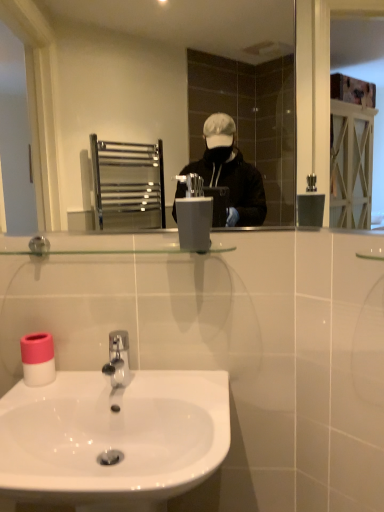
Question: Is white matte toilet paper at lower left bigger than satin grey plastic at center?

Choices:
 (A) yes
 (B) no

Answer: (B)

Question: Is satin grey plastic at center located within white matte toilet paper at lower left?

Choices:
 (A) yes
 (B) no

Answer: (B)

Question: Can you see white matte toilet paper at lower left touching satin grey plastic at center?

Choices:
 (A) no
 (B) yes

Answer: (A)

Question: From the image's perspective, is white matte toilet paper at lower left above satin grey plastic at center?

Choices:
 (A) yes
 (B) no

Answer: (B)

Question: Are white matte toilet paper at lower left and satin grey plastic at center located far from each other?

Choices:
 (A) yes
 (B) no

Answer: (B)

Question: In the image, is white glossy sink at lower center on the left side or the right side of satin grey plastic at center?

Choices:
 (A) right
 (B) left

Answer: (B)

Question: Is white glossy sink at lower center in front of or behind satin grey plastic at center in the image?

Choices:
 (A) front
 (B) behind

Answer: (A)

Question: From the image's perspective, is white glossy sink at lower center positioned above or below satin grey plastic at center?

Choices:
 (A) above
 (B) below

Answer: (B)

Question: Considering the positions of white glossy sink at lower center and satin grey plastic at center in the image, is white glossy sink at lower center taller or shorter than satin grey plastic at center?

Choices:
 (A) short
 (B) tall

Answer: (B)

Question: Considering the positions of satin grey plastic at center and white glossy sink at lower center in the image, is satin grey plastic at center taller or shorter than white glossy sink at lower center?

Choices:
 (A) tall
 (B) short

Answer: (B)

Question: Considering the relative positions of satin grey plastic at center and white glossy sink at lower center in the image provided, is satin grey plastic at center to the left or to the right of white glossy sink at lower center?

Choices:
 (A) left
 (B) right

Answer: (B)

Question: Is satin grey plastic at center wider or thinner than white glossy sink at lower center?

Choices:
 (A) thin
 (B) wide

Answer: (A)

Question: Would you say satin grey plastic at center is inside or outside white glossy sink at lower center?

Choices:
 (A) outside
 (B) inside

Answer: (A)

Question: In terms of height, does metallic silver mirror at upper center look taller or shorter compared to white matte toilet paper at lower left?

Choices:
 (A) short
 (B) tall

Answer: (B)

Question: Choose the correct answer: Is metallic silver mirror at upper center inside white matte toilet paper at lower left or outside it?

Choices:
 (A) inside
 (B) outside

Answer: (B)